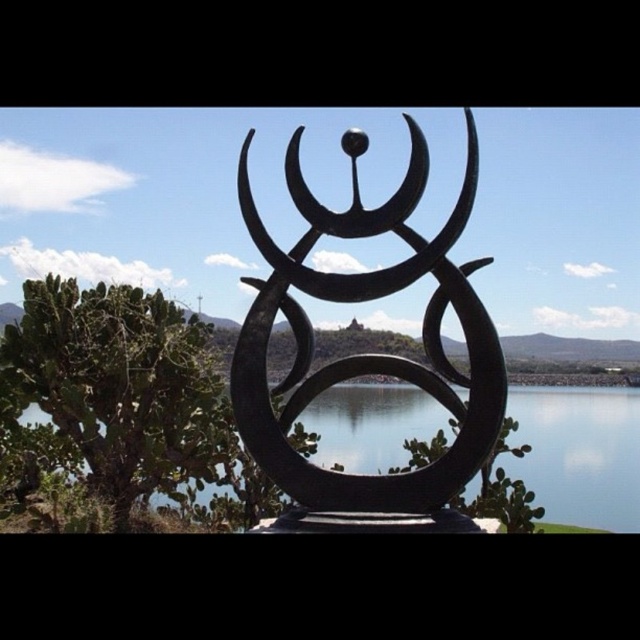
Question: Which object is farther from the camera taking this photo?

Choices:
 (A) black matte sculpture at center
 (B) transparent glass water at center

Answer: (B)

Question: From the image, what is the correct spatial relationship of black matte sculpture at center in relation to transparent glass water at center?

Choices:
 (A) left
 (B) right

Answer: (A)

Question: Which object appears farthest from the camera in this image?

Choices:
 (A) black matte sculpture at center
 (B) transparent glass water at center

Answer: (B)

Question: Where is black matte sculpture at center located in relation to transparent glass water at center in the image?

Choices:
 (A) above
 (B) below

Answer: (A)

Question: Which of the following is the closest to the observer?

Choices:
 (A) (349, 509)
 (B) (528, 432)

Answer: (A)

Question: Is black matte sculpture at center positioned in front of transparent glass water at center?

Choices:
 (A) no
 (B) yes

Answer: (B)